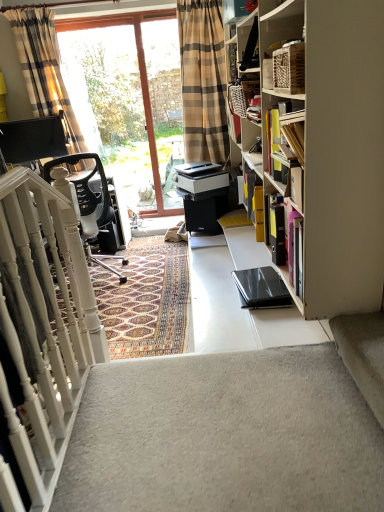
Locate an element on the screen. This screenshot has height=512, width=384. vacant area that is in front of black glossy phone at right is located at coordinates (280, 324).